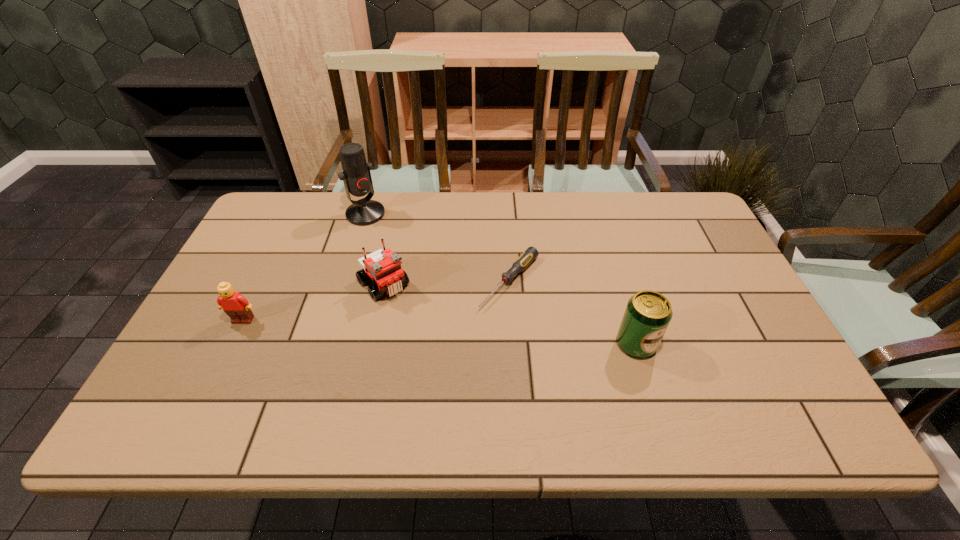
You are a GUI agent. You are given a task and a screenshot of the screen. Output one action in this format:
    pyautogui.click(x=<x>, y=<y>)
    Task: Click on the empty space between the tallest object and the screwdriver
    The width and height of the screenshot is (960, 540).
    Given the screenshot: What is the action you would take?
    pyautogui.click(x=438, y=247)

You are a GUI agent. You are given a task and a screenshot of the screen. Output one action in this format:
    pyautogui.click(x=<x>, y=<y>)
    Task: Click on the free space between the right Lego and the fourth object from left to right
    This screenshot has width=960, height=540.
    Given the screenshot: What is the action you would take?
    pyautogui.click(x=446, y=282)

Image resolution: width=960 pixels, height=540 pixels. Identify the location of free spot between the right Lego and the farthest object. (374, 248).

You are a GUI agent. You are given a task and a screenshot of the screen. Output one action in this format:
    pyautogui.click(x=<x>, y=<y>)
    Task: Click on the empty location between the nearest object and the fourth farthest object
    Image resolution: width=960 pixels, height=540 pixels.
    Given the screenshot: What is the action you would take?
    pyautogui.click(x=440, y=332)

Identify the location of unoccupied position between the beer can and the shortest object. (573, 313).

Locate an element on the screen. The width and height of the screenshot is (960, 540). free spot between the rightmost object and the fourth farthest object is located at coordinates (440, 332).

This screenshot has width=960, height=540. I want to click on vacant region between the shortest object and the microphone, so click(x=438, y=247).

Identify which object is the fourth closest to the shortest object. Please provide its 2D coordinates. Your answer should be formatted as a tuple, i.e. [(x, y)], where the tuple contains the x and y coordinates of a point satisfying the conditions above.

[(236, 306)]

Find the location of a particular element. the second closest object to the second nearest object is located at coordinates (356, 175).

The width and height of the screenshot is (960, 540). Find the location of `vacant area that satisfies the following two spatial constraints: 1. on the face of the rightmost object; 2. on the left side of the nearer Lego`. vacant area that satisfies the following two spatial constraints: 1. on the face of the rightmost object; 2. on the left side of the nearer Lego is located at coordinates (231, 344).